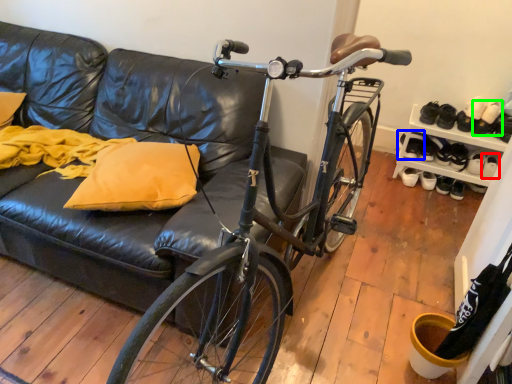
Question: Estimate the real-world distances between objects in this image. Which object is farther from footwear (highlighted by a red box), footwear (highlighted by a blue box) or footwear (highlighted by a green box)?

Choices:
 (A) footwear
 (B) footwear

Answer: (A)